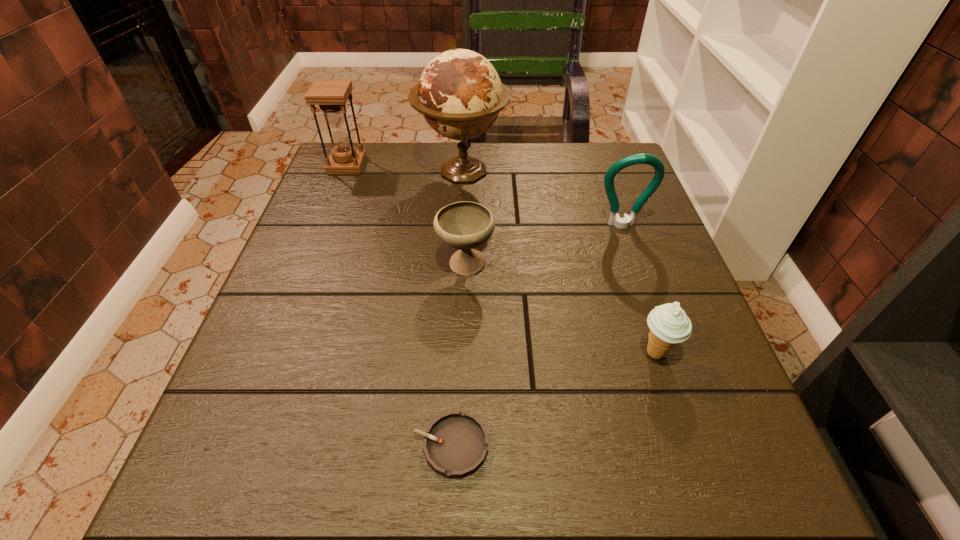
I want to click on free space at the far edge of the desktop, so 549,147.

In the image, there is a desktop. Where is `vacant space at the near edge`? This screenshot has height=540, width=960. vacant space at the near edge is located at coordinates (378, 505).

Where is `free space at the left edge of the desktop`? The height and width of the screenshot is (540, 960). free space at the left edge of the desktop is located at coordinates (303, 408).

You are a GUI agent. You are given a task and a screenshot of the screen. Output one action in this format:
    pyautogui.click(x=<x>, y=<y>)
    Task: Click on the vacant point at the right edge
    
    Given the screenshot: What is the action you would take?
    click(x=621, y=203)

The image size is (960, 540). What are the coordinates of `vacant region at the far right corner of the desktop` in the screenshot? It's located at (586, 182).

This screenshot has height=540, width=960. Find the location of `vacant area at the near right corner of the desktop`. vacant area at the near right corner of the desktop is located at coordinates (774, 498).

The height and width of the screenshot is (540, 960). Identify the location of free space between the fourth farthest object and the third farthest object. (543, 246).

Locate an element on the screen. empty location between the hourglass and the globe is located at coordinates (404, 168).

Locate an element on the screen. The image size is (960, 540). vacant area that lies between the chalice and the second nearest object is located at coordinates (561, 309).

This screenshot has height=540, width=960. Identify the location of empty space between the chalice and the icecream. (561, 309).